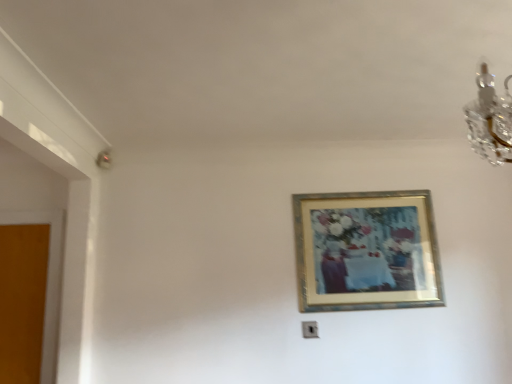
The width and height of the screenshot is (512, 384). Describe the element at coordinates (366, 251) in the screenshot. I see `gold metallic picture frame at upper right` at that location.

Image resolution: width=512 pixels, height=384 pixels. Identify the location of gold metallic picture frame at upper right. 366,251.

I want to click on gold metallic picture frame at upper right, so click(366, 251).